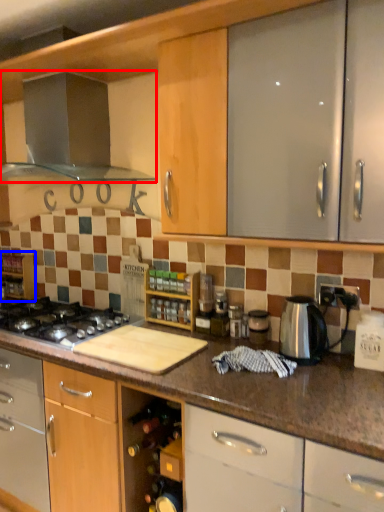
Question: Which object appears closest to the camera in this image, kitchen appliance (highlighted by a red box) or shelf (highlighted by a blue box)?

Choices:
 (A) kitchen appliance
 (B) shelf

Answer: (A)